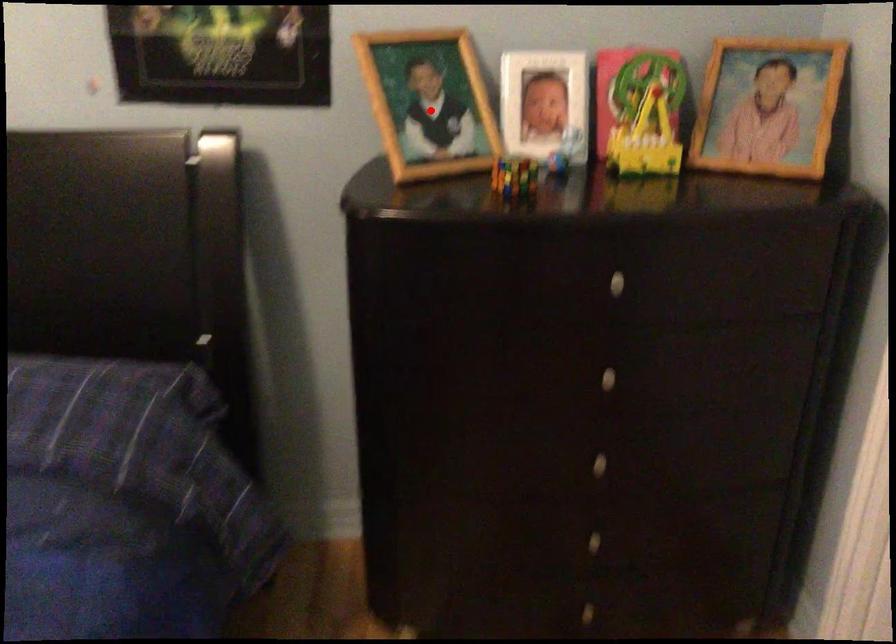
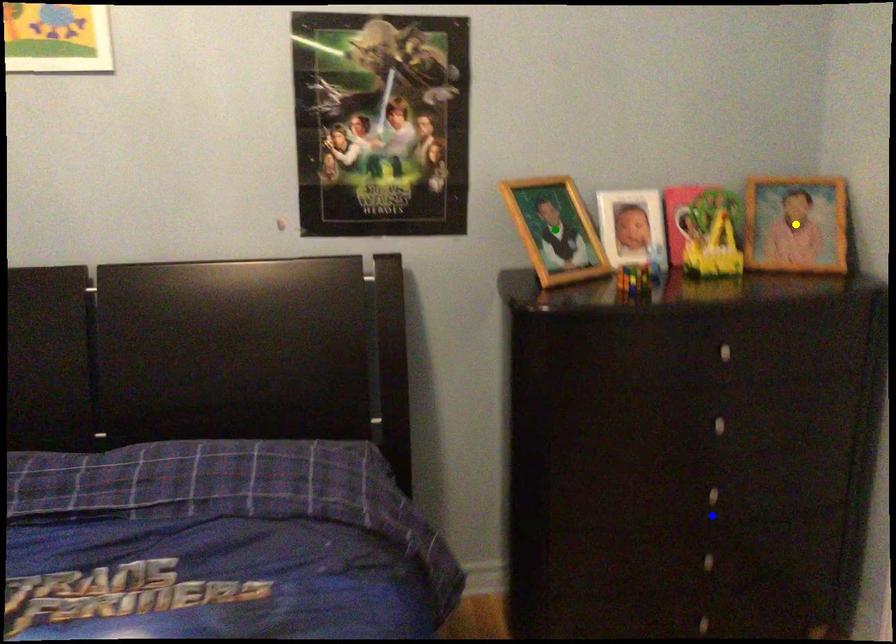
Question: I am providing you with two images of the same scene from different viewpoints. A red point is marked on the first image. You are given multiple points on the second image. In image 2, which mark is for the same physical point as the one in image 1?

Choices:
 (A) green point
 (B) blue point
 (C) yellow point

Answer: (A)